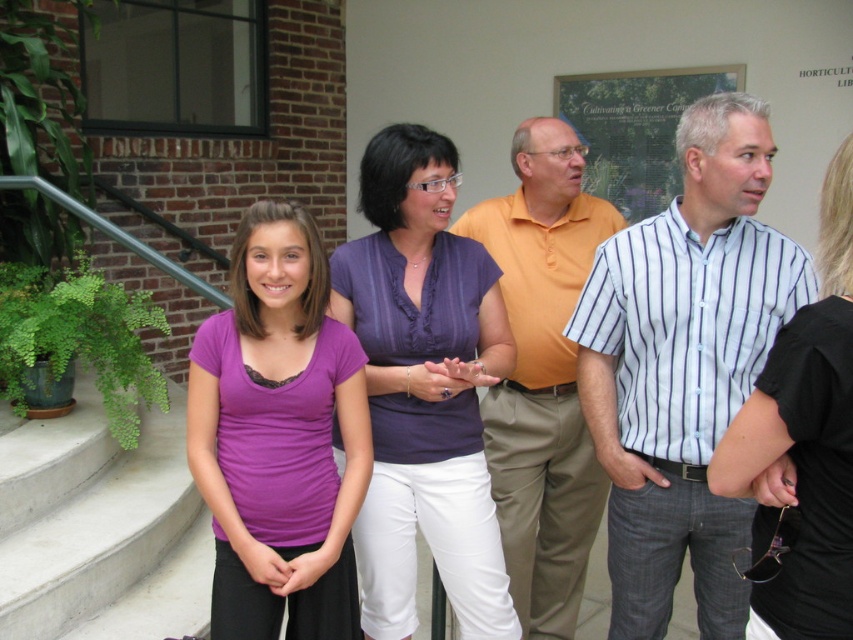
Question: Estimate the real-world distances between objects in this image. Which object is farther from the purple satin blouse at center?

Choices:
 (A) concrete stairs at lower left
 (B) black matte shirt at center

Answer: (A)

Question: Which of the following is the closest to the observer?

Choices:
 (A) (633, 248)
 (B) (502, 301)

Answer: (A)

Question: Does striped cotton shirt at center have a smaller size compared to purple fabric shirt at center?

Choices:
 (A) no
 (B) yes

Answer: (A)

Question: Can you confirm if purple fabric shirt at center is thinner than orange cotton shirt at center?

Choices:
 (A) no
 (B) yes

Answer: (B)

Question: Is white striped shirt at right above black matte shirt at center?

Choices:
 (A) no
 (B) yes

Answer: (B)

Question: Which point is farther to the camera?

Choices:
 (A) concrete stairs at lower left
 (B) orange cotton shirt at center
 (C) purple fabric shirt at center
 (D) striped cotton shirt at center

Answer: (A)